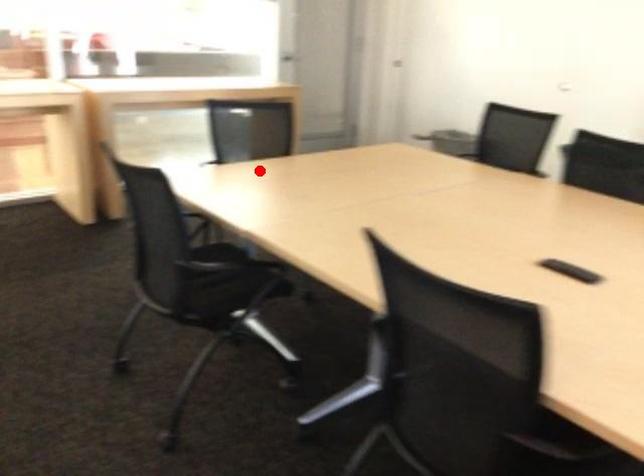
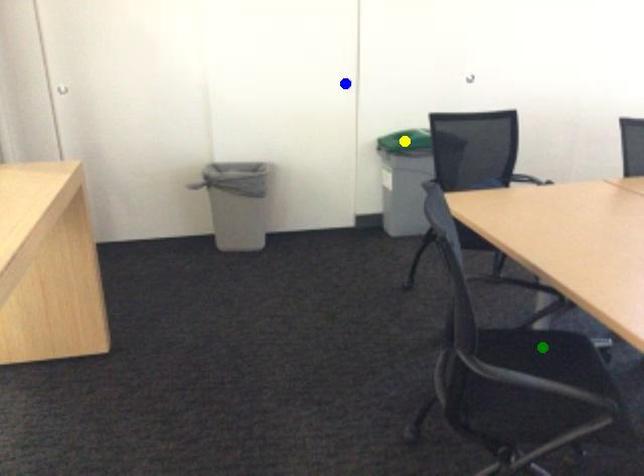
Question: I am providing you with two images of the same scene from different viewpoints. A red point is marked on the first image. You are given multiple points on the second image. Which mark in image 2 goes with the point in image 1?

Choices:
 (A) blue point
 (B) yellow point
 (C) green point

Answer: (C)